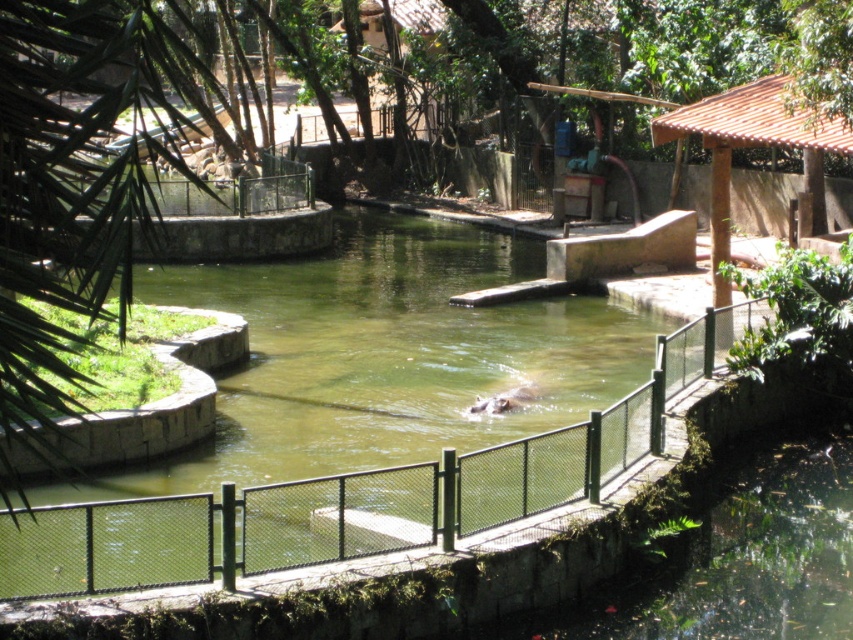
You are a zookeeper standing at the entrance of the enclosure. You need to place a new feeding tray for the gray matte hippo at center. The feeding tray must be placed in a position that is not blocked by the brown tiled roof at upper right. Where should you place the feeding tray?

The brown tiled roof at upper right is located above the gray matte hippo at center. To avoid blocking the feeding tray, place it below the brown tiled roof at upper right, near the hippo.